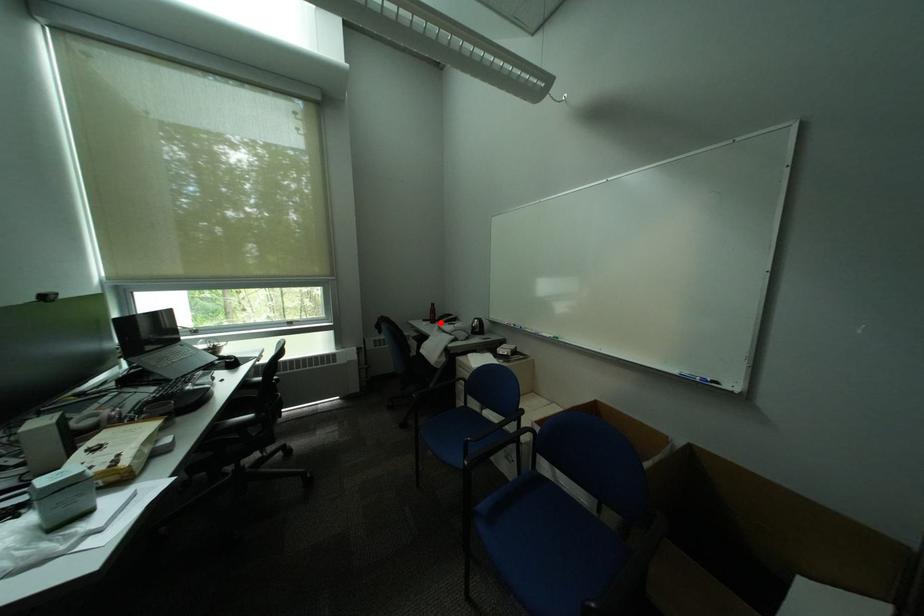
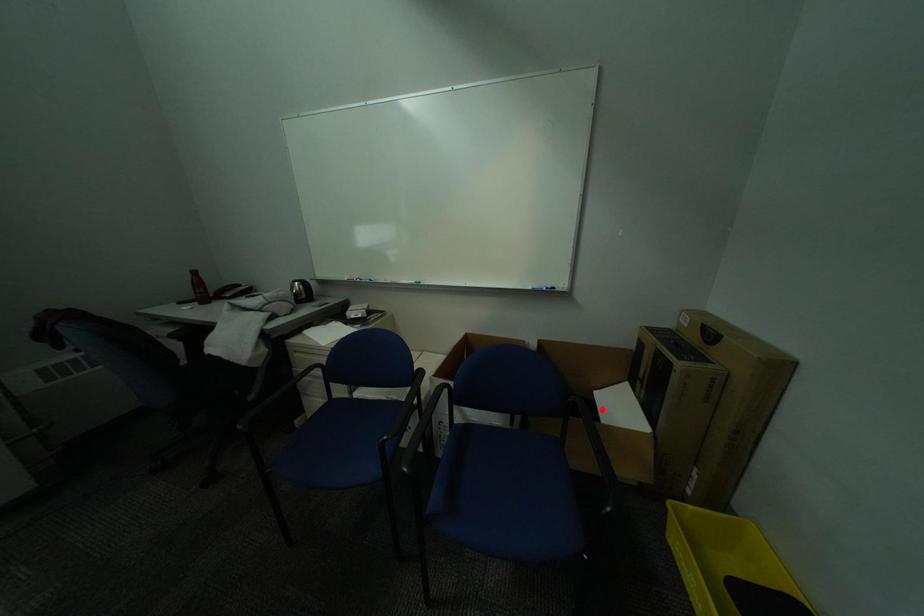
I am providing you with two images of the same scene from different viewpoints. A red point is marked on the first image and another point is marked on the second image. Are the points marked in image1 and image2 representing the same 3D position?

No